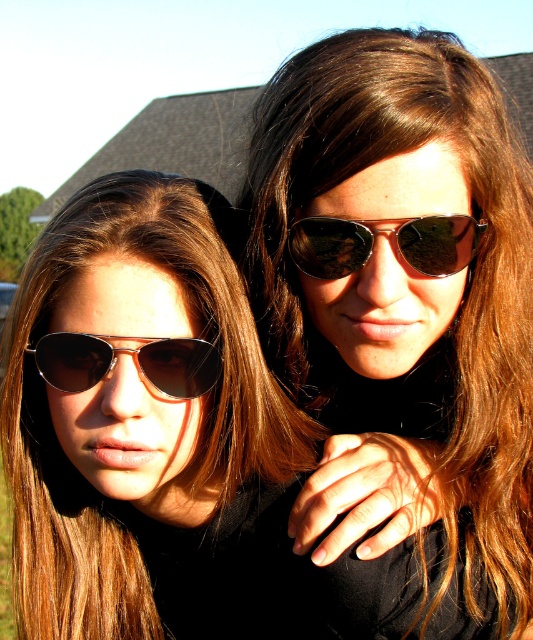
Question: Is shiny orange aviator sunglasses at upper right to the left of metallic aviator sunglasses at center from the viewer's perspective?

Choices:
 (A) yes
 (B) no

Answer: (B)

Question: Which point is closer to the camera?

Choices:
 (A) brown shiny hair at upper right
 (B) metallic aviator sunglasses at center
 (C) shiny orange aviator sunglasses at upper right

Answer: (A)

Question: Which object is closer to the camera taking this photo?

Choices:
 (A) metallic aviator sunglasses at center
 (B) brown shiny hair at upper right

Answer: (B)

Question: Is brown shiny hair at left in front of shiny orange aviator sunglasses at upper right?

Choices:
 (A) no
 (B) yes

Answer: (A)

Question: Which object appears closest to the camera in this image?

Choices:
 (A) metallic aviator sunglasses at center
 (B) brown shiny hair at left
 (C) brown shiny hair at upper right

Answer: (C)

Question: Is brown shiny hair at upper right to the right of shiny orange aviator sunglasses at upper right from the viewer's perspective?

Choices:
 (A) yes
 (B) no

Answer: (A)